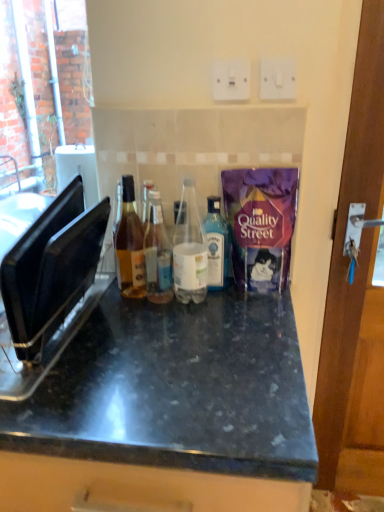
At what (x,y) coordinates should I click in order to perform the action: click on wooden door at right. Please return your answer as a coordinate pair (x, y). The width and height of the screenshot is (384, 512). Looking at the image, I should click on (356, 293).

What do you see at coordinates (231, 79) in the screenshot? Image resolution: width=384 pixels, height=512 pixels. I see `white plastic electric outlet at upper center, acting as the 2th electric outlet starting from the right` at bounding box center [231, 79].

What do you see at coordinates (176, 390) in the screenshot?
I see `black granite countertop at center` at bounding box center [176, 390].

Where is `white plastic switch at upper center, the first electric outlet viewed from the right`? white plastic switch at upper center, the first electric outlet viewed from the right is located at coordinates (278, 78).

Find the location of a particular element. blue glass bottle at center, which ranks as the 4th bottle in left-to-right order is located at coordinates (217, 245).

What do you see at coordinates (217, 245) in the screenshot? This screenshot has height=512, width=384. I see `blue glass bottle at center, the first bottle viewed from the right` at bounding box center [217, 245].

What is the approximate width of translucent glass bottle at center, which is counted as the 3th bottle, starting from the right?

It is 3.85 inches.

What do you see at coordinates (157, 253) in the screenshot? I see `translucent glass bottle at center, the second bottle in the left-to-right sequence` at bounding box center [157, 253].

What are the coordinates of `amber glass bottle at center, the 1th bottle in the left-to-right sequence` in the screenshot? It's located at (130, 245).

From a real-world perspective, is blue glass bottle at center, the first bottle viewed from the right, located beneath amber glass bottle at center, the 1th bottle in the left-to-right sequence?

Correct, in the physical world, blue glass bottle at center, the first bottle viewed from the right, is lower than amber glass bottle at center, the 1th bottle in the left-to-right sequence.

Does blue glass bottle at center, the first bottle viewed from the right, appear on the left side of amber glass bottle at center, which is counted as the 4th bottle, starting from the right?

No, blue glass bottle at center, the first bottle viewed from the right, is not to the left of amber glass bottle at center, which is counted as the 4th bottle, starting from the right.

Are blue glass bottle at center, which ranks as the 4th bottle in left-to-right order, and amber glass bottle at center, the 1th bottle in the left-to-right sequence, located far from each other?

No, blue glass bottle at center, which ranks as the 4th bottle in left-to-right order, is not far from amber glass bottle at center, the 1th bottle in the left-to-right sequence.

Consider the image. Can you confirm if blue glass bottle at center, the first bottle viewed from the right, is wider than amber glass bottle at center, the 1th bottle in the left-to-right sequence?

No.

Could you measure the distance between white plastic electric outlet at upper center, acting as the 2th electric outlet starting from the right, and translucent glass bottle at center, which is counted as the 3th bottle, starting from the right?

14.71 inches.

Can you tell me how much white plastic electric outlet at upper center, acting as the 2th electric outlet starting from the right, and translucent glass bottle at center, the second bottle in the left-to-right sequence, differ in facing direction?

white plastic electric outlet at upper center, acting as the 2th electric outlet starting from the right, and translucent glass bottle at center, the second bottle in the left-to-right sequence, are facing 0.21 degrees away from each other.

From the image's perspective, starting from the white plastic electric outlet at upper center, the 1th electric outlet positioned from the left, which bottle is the 4th one below? Please provide its 2D coordinates.

[(157, 253)]

Considering the positions of objects white plastic electric outlet at upper center, the 1th electric outlet positioned from the left, and translucent glass bottle at center, which is counted as the 3th bottle, starting from the right, in the image provided, who is behind, white plastic electric outlet at upper center, the 1th electric outlet positioned from the left, or translucent glass bottle at center, which is counted as the 3th bottle, starting from the right,?

white plastic electric outlet at upper center, the 1th electric outlet positioned from the left, is further from the camera.

From a real-world perspective, is white plastic electric outlet at upper center, acting as the 2th electric outlet starting from the right, beneath blue glass bottle at center, the first bottle viewed from the right?

No, from a real-world perspective, white plastic electric outlet at upper center, acting as the 2th electric outlet starting from the right, is not beneath blue glass bottle at center, the first bottle viewed from the right.

Is white plastic electric outlet at upper center, acting as the 2th electric outlet starting from the right, looking in the opposite direction of blue glass bottle at center, which ranks as the 4th bottle in left-to-right order?

No, white plastic electric outlet at upper center, acting as the 2th electric outlet starting from the right, is not facing the opposite direction of blue glass bottle at center, which ranks as the 4th bottle in left-to-right order.

Can you see white plastic electric outlet at upper center, acting as the 2th electric outlet starting from the right, touching blue glass bottle at center, the first bottle viewed from the right?

No, white plastic electric outlet at upper center, acting as the 2th electric outlet starting from the right, is not touching blue glass bottle at center, the first bottle viewed from the right.

Which of these two, white plastic electric outlet at upper center, acting as the 2th electric outlet starting from the right, or blue glass bottle at center, which ranks as the 4th bottle in left-to-right order, is bigger?

Bigger between the two is blue glass bottle at center, which ranks as the 4th bottle in left-to-right order.

Does point (219, 96) come behind point (1, 289)?

Yes.

How many degrees apart are the facing directions of white plastic electric outlet at upper center, the 1th electric outlet positioned from the left, and black plastic toaster at left?

The angle between the facing direction of white plastic electric outlet at upper center, the 1th electric outlet positioned from the left, and the facing direction of black plastic toaster at left is 1.95 degrees.

Between white plastic electric outlet at upper center, the 1th electric outlet positioned from the left, and black plastic toaster at left, which one has larger width?

Wider between the two is black plastic toaster at left.

From a real-world perspective, is white plastic electric outlet at upper center, the 1th electric outlet positioned from the left, on translucent plastic bottle at center, the 2th bottle from the right?

Correct, in the physical world, white plastic electric outlet at upper center, the 1th electric outlet positioned from the left, is higher than translucent plastic bottle at center, the 2th bottle from the right.

How much distance is there between white plastic electric outlet at upper center, acting as the 2th electric outlet starting from the right, and translucent plastic bottle at center, the 2th bottle from the right?

They are 13.53 inches apart.

Looking at this image, can you confirm if white plastic electric outlet at upper center, the 1th electric outlet positioned from the left, is positioned to the left of translucent plastic bottle at center, the 2th bottle from the right?

No.

Are white plastic electric outlet at upper center, acting as the 2th electric outlet starting from the right, and translucent plastic bottle at center, the third bottle when ordered from left to right, far apart?

Actually, white plastic electric outlet at upper center, acting as the 2th electric outlet starting from the right, and translucent plastic bottle at center, the third bottle when ordered from left to right, are a little close together.

Is point (214, 236) positioned after point (200, 265)?

That is True.

Is blue glass bottle at center, the first bottle viewed from the right, placed right next to translucent plastic bottle at center, the 2th bottle from the right?

Yes, blue glass bottle at center, the first bottle viewed from the right, is with translucent plastic bottle at center, the 2th bottle from the right.

Can you confirm if blue glass bottle at center, which ranks as the 4th bottle in left-to-right order, is smaller than translucent plastic bottle at center, the 2th bottle from the right?

Yes.

From the image's perspective, which is below, blue glass bottle at center, the first bottle viewed from the right, or translucent plastic bottle at center, the 2th bottle from the right?

blue glass bottle at center, the first bottle viewed from the right, from the image's perspective.

From a real-world perspective, is translucent glass bottle at center, the second bottle in the left-to-right sequence, positioned under wooden door at right based on gravity?

No, from a real-world perspective, translucent glass bottle at center, the second bottle in the left-to-right sequence, is not below wooden door at right.

Looking at this image, is translucent glass bottle at center, the second bottle in the left-to-right sequence, aimed at wooden door at right?

No, translucent glass bottle at center, the second bottle in the left-to-right sequence, is not oriented towards wooden door at right.

What's the angular difference between translucent glass bottle at center, which is counted as the 3th bottle, starting from the right, and wooden door at right's facing directions?

translucent glass bottle at center, which is counted as the 3th bottle, starting from the right, and wooden door at right are facing 0.452 degrees away from each other.

Considering the relative sizes of translucent glass bottle at center, the second bottle in the left-to-right sequence, and wooden door at right in the image provided, is translucent glass bottle at center, the second bottle in the left-to-right sequence, smaller than wooden door at right?

Yes.

Find the location of a particular element. This screenshot has height=512, width=384. the 1st bottle in front when counting from the blue glass bottle at center, the first bottle viewed from the right is located at coordinates (130, 245).

From a real-world perspective, count 1st electric outlets upward from the translucent glass bottle at center, which is counted as the 3th bottle, starting from the right, and point to it. Please provide its 2D coordinates.

[(231, 79)]

When comparing their distances from black granite countertop at center, does white plastic electric outlet at upper center, acting as the 2th electric outlet starting from the right, or white plastic switch at upper center, arranged as the 2th electric outlet when viewed from the left, seem further?

white plastic switch at upper center, arranged as the 2th electric outlet when viewed from the left, lies further to black granite countertop at center than the other object.

From the image, which object appears to be nearer to white plastic switch at upper center, the first electric outlet viewed from the right, blue glass bottle at center, the first bottle viewed from the right, or wooden door at right?

The object closer to white plastic switch at upper center, the first electric outlet viewed from the right, is blue glass bottle at center, the first bottle viewed from the right.

Considering their positions, is wooden door at right positioned further to blue glass bottle at center, the first bottle viewed from the right, than translucent plastic bottle at center, the third bottle when ordered from left to right?

wooden door at right lies further to blue glass bottle at center, the first bottle viewed from the right, than the other object.

When comparing their distances from blue glass bottle at center, the first bottle viewed from the right, does black plastic toaster at left or black granite countertop at center seem closer?

black granite countertop at center is positioned closer to the anchor blue glass bottle at center, the first bottle viewed from the right.

From the image, which object appears to be farther from amber glass bottle at center, the 1th bottle in the left-to-right sequence, translucent glass bottle at center, the second bottle in the left-to-right sequence, or translucent plastic bottle at center, the third bottle when ordered from left to right?

translucent plastic bottle at center, the third bottle when ordered from left to right.

From the image, which object appears to be farther from amber glass bottle at center, which is counted as the 4th bottle, starting from the right, white plastic electric outlet at upper center, the 1th electric outlet positioned from the left, or black granite countertop at center?

white plastic electric outlet at upper center, the 1th electric outlet positioned from the left, is positioned further to the anchor amber glass bottle at center, which is counted as the 4th bottle, starting from the right.

From the image, which object appears to be nearer to wooden door at right, amber glass bottle at center, which is counted as the 4th bottle, starting from the right, or white plastic electric outlet at upper center, the 1th electric outlet positioned from the left?

The object closer to wooden door at right is amber glass bottle at center, which is counted as the 4th bottle, starting from the right.

Considering their positions, is black granite countertop at center positioned further to translucent plastic bottle at center, the third bottle when ordered from left to right, than black plastic toaster at left?

Among the two, black plastic toaster at left is located further to translucent plastic bottle at center, the third bottle when ordered from left to right.

Locate an element on the screen. The width and height of the screenshot is (384, 512). appliance that lies between white plastic electric outlet at upper center, acting as the 2th electric outlet starting from the right, and black granite countertop at center from top to bottom is located at coordinates pos(49,288).

Locate an element on the screen. Image resolution: width=384 pixels, height=512 pixels. appliance that lies between translucent plastic bottle at center, the 2th bottle from the right, and black granite countertop at center from top to bottom is located at coordinates (49, 288).

Identify the location of bottle between white plastic switch at upper center, the first electric outlet viewed from the right, and translucent plastic bottle at center, the 2th bottle from the right, from top to bottom. (130, 245).

Find the location of `appliance between white plastic switch at upper center, the first electric outlet viewed from the right, and black granite countertop at center from top to bottom`. appliance between white plastic switch at upper center, the first electric outlet viewed from the right, and black granite countertop at center from top to bottom is located at coordinates (49, 288).